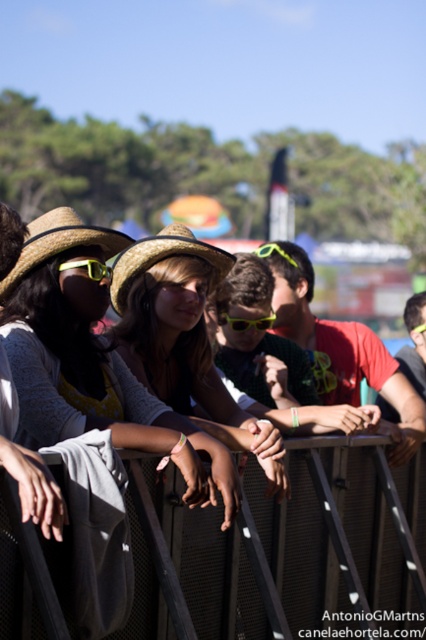
Question: Which object is farther from the camera taking this photo?

Choices:
 (A) straw hat at left
 (B) strawhat at center

Answer: (B)

Question: Is straw hat at left positioned at the back of strawhat at center?

Choices:
 (A) yes
 (B) no

Answer: (B)

Question: Does black metal fence at lower center appear on the left side of straw hat at left?

Choices:
 (A) yes
 (B) no

Answer: (B)

Question: Which of the following is the farthest from the observer?

Choices:
 (A) straw hat at left
 (B) strawhat at center

Answer: (B)

Question: Estimate the real-world distances between objects in this image. Which object is closer to the straw hat at left?

Choices:
 (A) strawhat at center
 (B) black metal fence at lower center

Answer: (A)

Question: Does straw hat at left come behind strawhat at center?

Choices:
 (A) yes
 (B) no

Answer: (B)